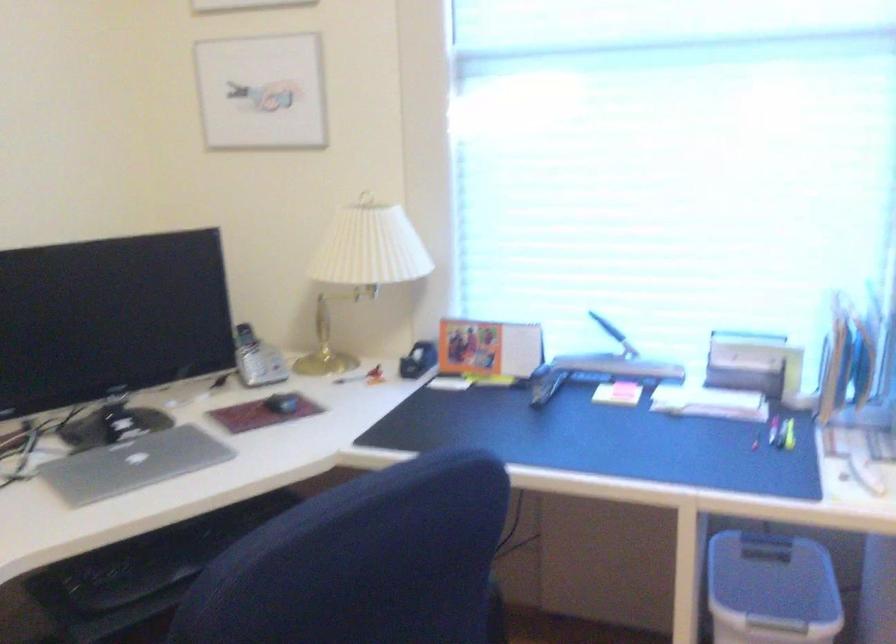
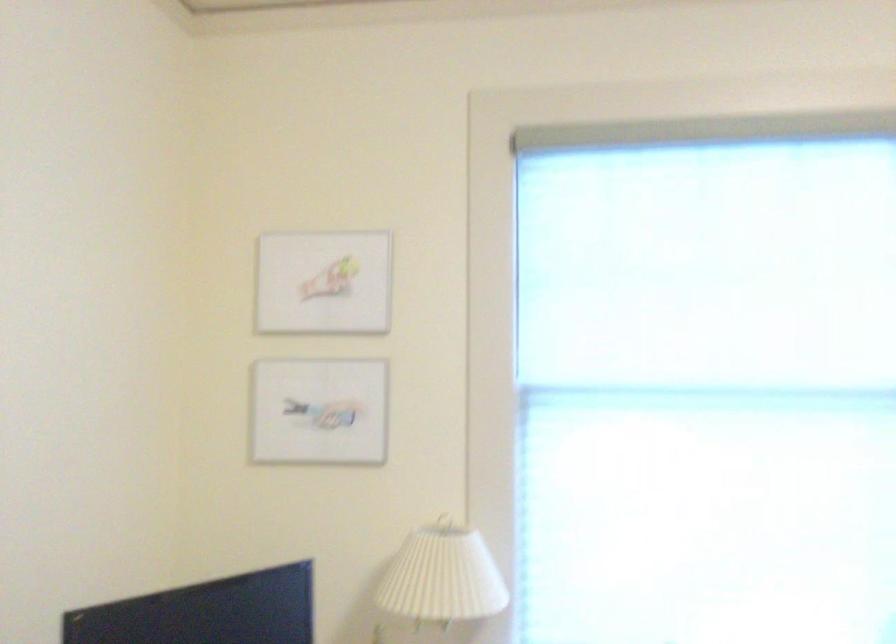
The point at (356, 248) is marked in the first image. Where is the corresponding point in the second image?

(443, 576)